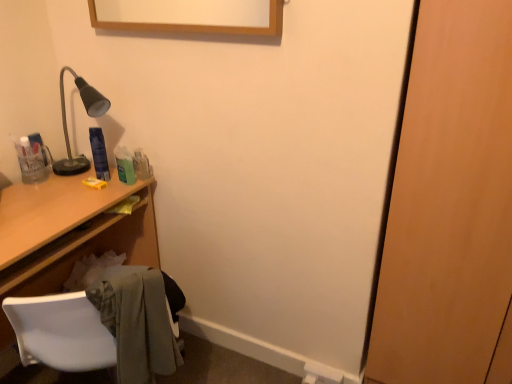
Question: Is the position of wooden desk at left less distant than that of blue plastic can at upper left?

Choices:
 (A) no
 (B) yes

Answer: (B)

Question: Are wooden desk at left and blue plastic can at upper left beside each other?

Choices:
 (A) yes
 (B) no

Answer: (B)

Question: Is the depth of wooden desk at left greater than that of blue plastic can at upper left?

Choices:
 (A) no
 (B) yes

Answer: (A)

Question: From a real-world perspective, does wooden desk at left stand above blue plastic can at upper left?

Choices:
 (A) no
 (B) yes

Answer: (A)

Question: Can you confirm if wooden desk at left is smaller than blue plastic can at upper left?

Choices:
 (A) yes
 (B) no

Answer: (B)

Question: From the image's perspective, relative to white plastic chair at lower left, is blue plastic can at upper left above or below?

Choices:
 (A) below
 (B) above

Answer: (B)

Question: Considering the positions of blue plastic can at upper left and white plastic chair at lower left in the image, is blue plastic can at upper left taller or shorter than white plastic chair at lower left?

Choices:
 (A) tall
 (B) short

Answer: (A)

Question: Based on their sizes in the image, would you say blue plastic can at upper left is bigger or smaller than white plastic chair at lower left?

Choices:
 (A) small
 (B) big

Answer: (A)

Question: Would you say blue plastic can at upper left is to the left or to the right of white plastic chair at lower left in the picture?

Choices:
 (A) right
 (B) left

Answer: (A)

Question: Is blue plastic can at upper left in front of or behind wooden door at right in the image?

Choices:
 (A) front
 (B) behind

Answer: (B)

Question: Is blue plastic can at upper left bigger or smaller than wooden door at right?

Choices:
 (A) big
 (B) small

Answer: (B)

Question: Considering the positions of blue plastic can at upper left and wooden door at right in the image, is blue plastic can at upper left taller or shorter than wooden door at right?

Choices:
 (A) short
 (B) tall

Answer: (A)

Question: Would you say blue plastic can at upper left is inside or outside wooden door at right?

Choices:
 (A) outside
 (B) inside

Answer: (A)

Question: Considering the positions of blue plastic can at upper left and wooden desk at left in the image, is blue plastic can at upper left taller or shorter than wooden desk at left?

Choices:
 (A) short
 (B) tall

Answer: (A)

Question: Which is correct: blue plastic can at upper left is inside wooden desk at left, or outside of it?

Choices:
 (A) inside
 (B) outside

Answer: (B)